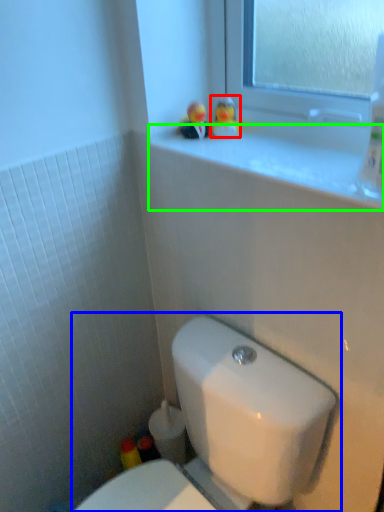
Question: Estimate the real-world distances between objects in this image. Which object is closer to miniature (highlighted by a red box), toilet (highlighted by a blue box) or window sill (highlighted by a green box)?

Choices:
 (A) toilet
 (B) window sill

Answer: (B)